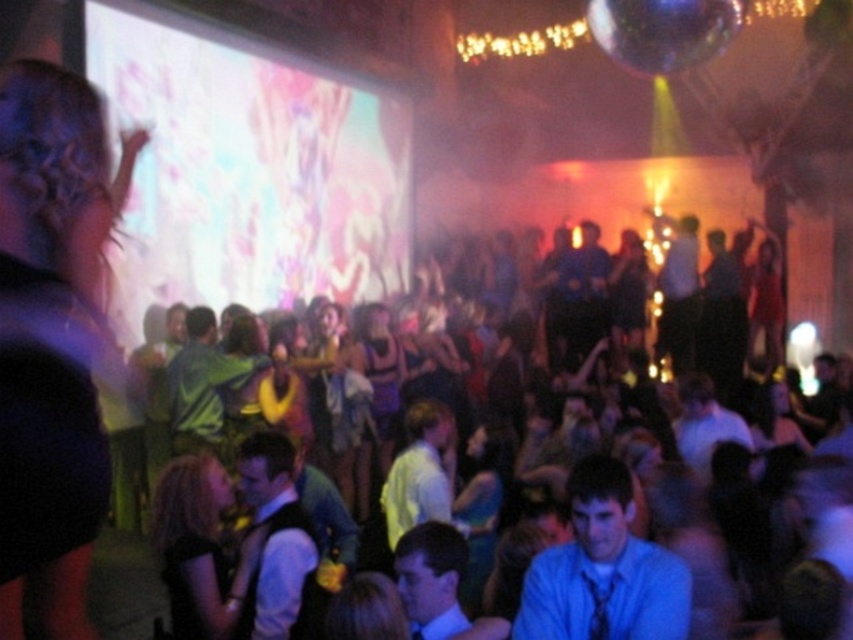
Question: Among these objects, which one is nearest to the camera?

Choices:
 (A) shiny purple dress at center
 (B) black satin dress at lower left

Answer: (B)

Question: Estimate the real-world distances between objects in this image. Which object is closer to the black satin dress at lower left?

Choices:
 (A) shiny purple dress at center
 (B) white glossy projection screen at upper left

Answer: (A)

Question: Can you confirm if white glossy projection screen at upper left is wider than shiny purple dress at center?

Choices:
 (A) yes
 (B) no

Answer: (A)

Question: Which point appears closest to the camera in this image?

Choices:
 (A) (207, 268)
 (B) (386, 307)

Answer: (A)

Question: Can you confirm if white glossy projection screen at upper left is bigger than black satin dress at lower left?

Choices:
 (A) no
 (B) yes

Answer: (B)

Question: Can you confirm if white glossy projection screen at upper left is positioned to the left of black satin dress at lower left?

Choices:
 (A) yes
 (B) no

Answer: (A)